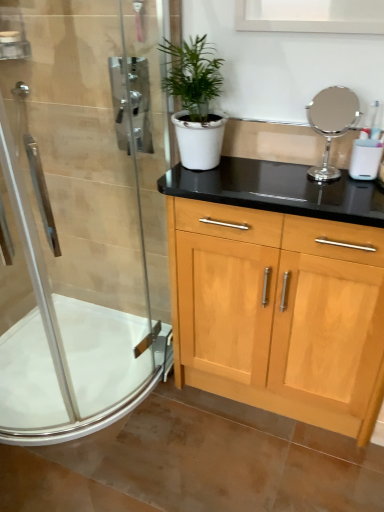
Question: From the image's perspective, would you say white matte pot at center is positioned over polished chrome mirror at upper right?

Choices:
 (A) yes
 (B) no

Answer: (A)

Question: Can you confirm if white matte pot at center is shorter than polished chrome mirror at upper right?

Choices:
 (A) yes
 (B) no

Answer: (B)

Question: Does white matte pot at center have a greater width compared to polished chrome mirror at upper right?

Choices:
 (A) no
 (B) yes

Answer: (B)

Question: Is white matte pot at center further to the viewer compared to polished chrome mirror at upper right?

Choices:
 (A) no
 (B) yes

Answer: (A)

Question: Is white matte pot at center directly adjacent to polished chrome mirror at upper right?

Choices:
 (A) yes
 (B) no

Answer: (B)

Question: From a real-world perspective, is white matte pot at center on top of polished chrome mirror at upper right?

Choices:
 (A) no
 (B) yes

Answer: (B)

Question: From a real-world perspective, is clear glass shower door at left beneath white glossy bath at lower left?

Choices:
 (A) no
 (B) yes

Answer: (A)

Question: Is clear glass shower door at left next to white glossy bath at lower left?

Choices:
 (A) no
 (B) yes

Answer: (A)

Question: Can you confirm if clear glass shower door at left is bigger than white glossy bath at lower left?

Choices:
 (A) no
 (B) yes

Answer: (B)

Question: Does clear glass shower door at left have a lesser width compared to white glossy bath at lower left?

Choices:
 (A) no
 (B) yes

Answer: (B)

Question: Is white glossy bath at lower left located within clear glass shower door at left?

Choices:
 (A) no
 (B) yes

Answer: (A)

Question: Is clear glass shower door at left completely or partially outside of white glossy bath at lower left?

Choices:
 (A) yes
 (B) no

Answer: (A)

Question: From a real-world perspective, is polished chrome mirror at upper right located beneath white glossy bath at lower left?

Choices:
 (A) no
 (B) yes

Answer: (A)